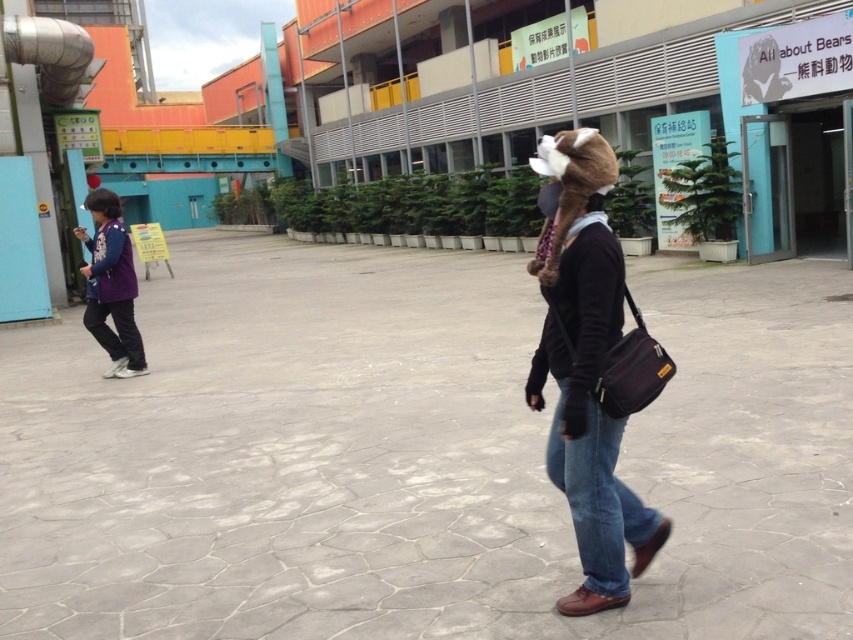
You are standing at the center of the scene. Which direction should you walk to reach the denim jeans at lower right?

The denim jeans at lower right is located at point (601, 497), so you should walk towards the lower right direction to reach it.

You are standing at the origin point in the image. Which of the two points, point (659,538) or point (115,225), is closer to you?

Point (659,538) is closer to you because it is in front of point (115,225).

You are a photographer trying to capture a clear shot of both the brown fur hat at right and the denim jeans at lower right in the scene. Since you want to ensure both are visible, which object should you focus on first to account for their sizes?

The brown fur hat at right is bigger than the denim jeans at lower right, so you should focus on the brown fur hat at right first since it occupies more space in the frame, ensuring it is in focus before adjusting for the smaller denim jeans at lower right.